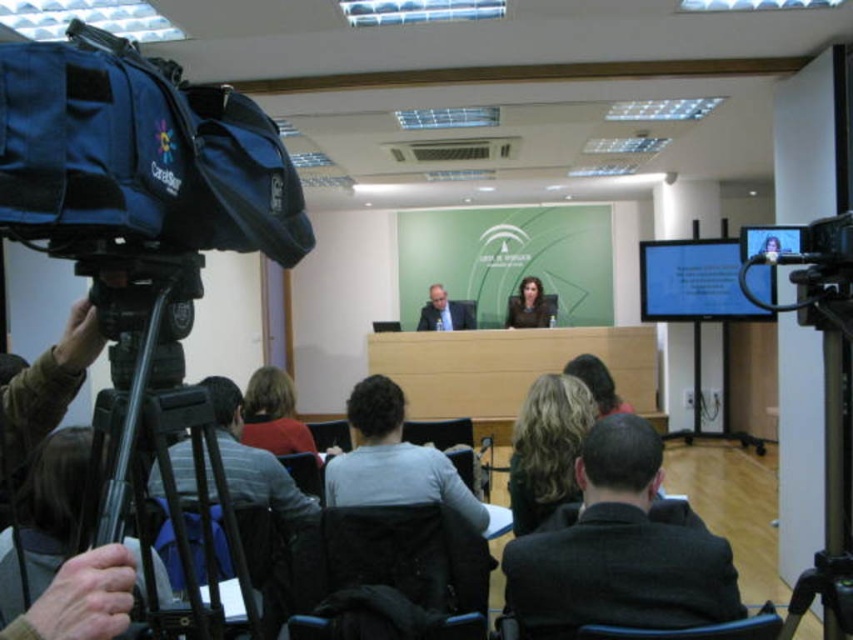
Question: Does dark gray fabric jacket at lower left appear on the right side of matte black suit at center?

Choices:
 (A) no
 (B) yes

Answer: (A)

Question: Which of these objects is positioned closest to the dark gray fabric chair at center?

Choices:
 (A) black fabric chair at center
 (B) blonde hair at center
 (C) gray fabric jacket at lower left

Answer: (C)

Question: From the image, what is the correct spatial relationship of dark gray fabric jacket at lower left in relation to matte black suit at center?

Choices:
 (A) below
 (B) above

Answer: (A)

Question: Does dark gray suit at center have a smaller size compared to gray fabric jacket at lower left?

Choices:
 (A) yes
 (B) no

Answer: (A)

Question: Which of these objects is positioned closest to the black plastic chair at lower center?

Choices:
 (A) matte brown hair at center
 (B) blonde hair at center
 (C) blue fabric video camera at left
 (D) black fabric chair at center

Answer: (B)

Question: Which of these objects is positioned closest to the blue fabric video camera at left?

Choices:
 (A) black plastic chair at lower center
 (B) blonde hair at center
 (C) dark gray suit at center
 (D) black plastic tripod at left

Answer: (D)